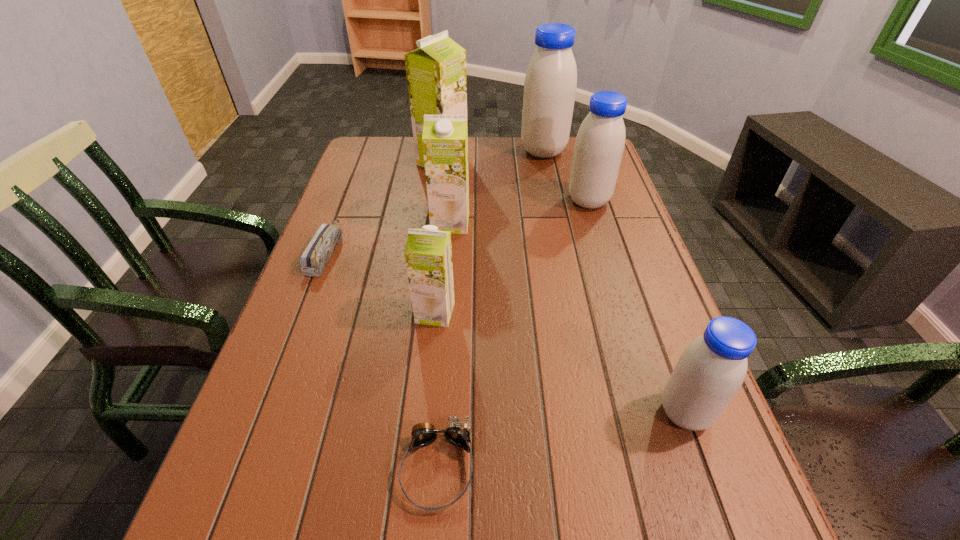
In the image, there is a desktop. Where is `vacant area at the right edge`? This screenshot has height=540, width=960. vacant area at the right edge is located at coordinates (623, 193).

The image size is (960, 540). Identify the location of vacant space at the far left corner of the desktop. (396, 141).

Identify the location of free space between the goggles and the fifth farthest soya milk. (436, 390).

You are a GUI agent. You are given a task and a screenshot of the screen. Output one action in this format:
    pyautogui.click(x=<x>, y=<y>)
    Task: Click on the free space between the second nearest blue soya milk and the nearest soya milk
    This screenshot has height=540, width=960.
    Given the screenshot: What is the action you would take?
    pyautogui.click(x=636, y=307)

The height and width of the screenshot is (540, 960). I want to click on free area in between the second smallest green soya milk and the nearest soya milk, so pos(567,318).

Identify the location of free space between the farthest blue soya milk and the second smallest green soya milk. (497, 187).

Identify the location of vacant area that lies between the smallest blue soya milk and the farthest green soya milk. This screenshot has height=540, width=960. (564, 287).

Identify the location of unoccupied area between the leftmost object and the bronze goggles. (382, 360).

At what (x,y) coordinates should I click in order to perform the action: click on empty space between the nearest soya milk and the leftmost object. Please return your answer as a coordinate pair (x, y). Image resolution: width=960 pixels, height=540 pixels. Looking at the image, I should click on (505, 332).

You are a GUI agent. You are given a task and a screenshot of the screen. Output one action in this format:
    pyautogui.click(x=<x>, y=<y>)
    Task: Click on the vacant area that lies between the bronze goggles and the pencil box
    
    Given the screenshot: What is the action you would take?
    pyautogui.click(x=382, y=360)